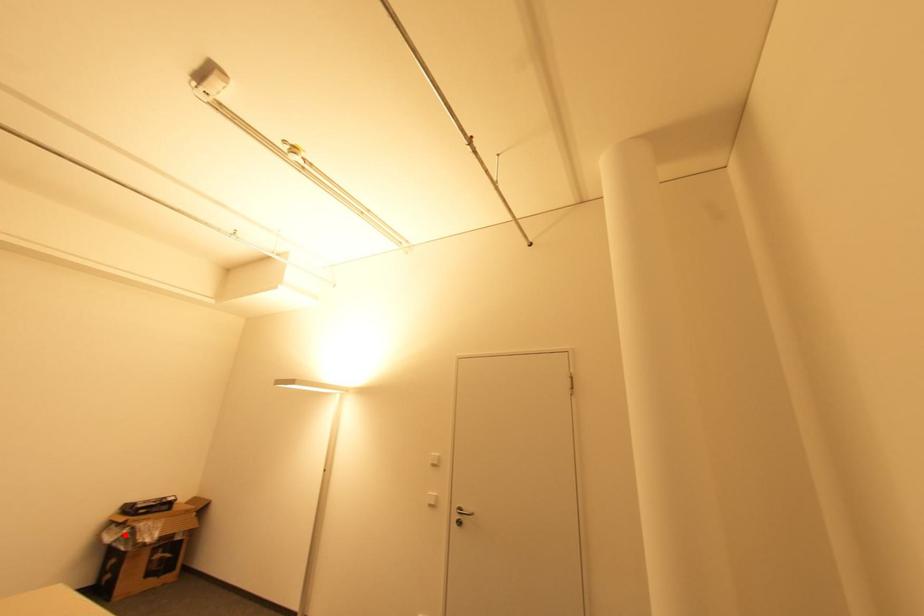
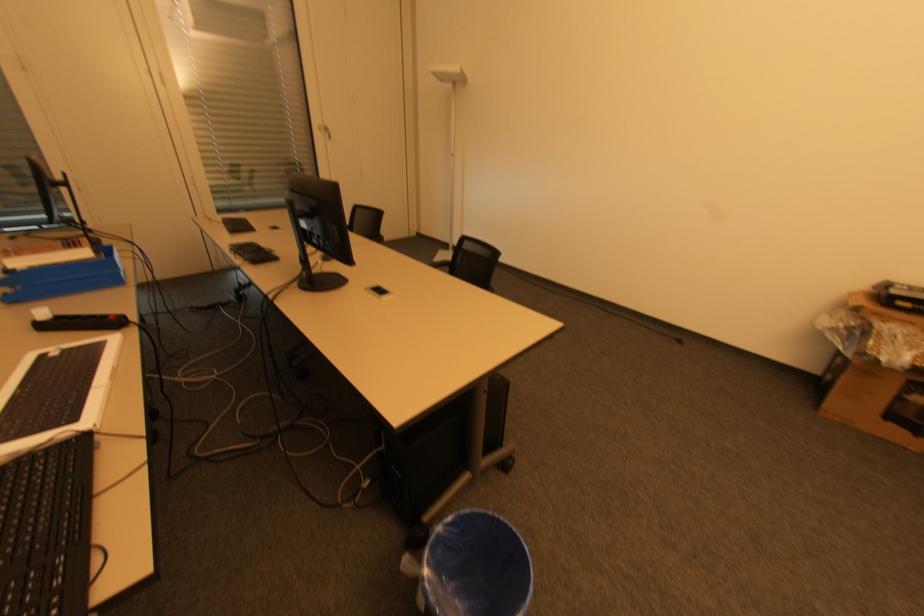
Question: I am providing you with two images of the same scene from different viewpoints. A red point is marked on the first image. Can you still see the location of the red point in image 2?

Choices:
 (A) Yes
 (B) No

Answer: (A)